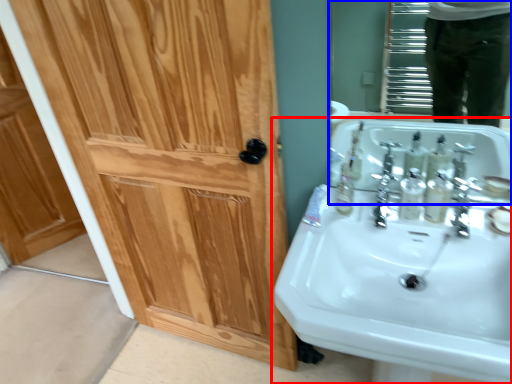
Question: Which object appears closest to the camera in this image, sink (highlighted by a red box) or mirror (highlighted by a blue box)?

Choices:
 (A) sink
 (B) mirror

Answer: (A)